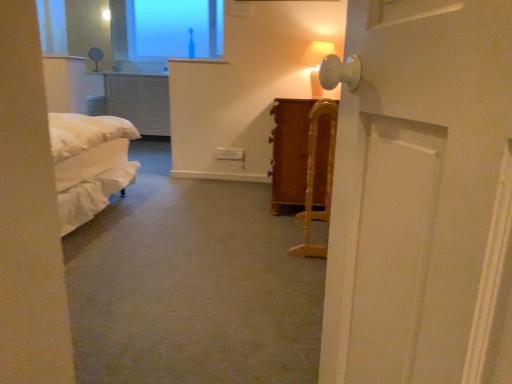
Question: From the image's perspective, relative to matte white table lamp at upper center, placed as the second table lamp when sorted from bottom to top, is wooden cane at center above or below?

Choices:
 (A) above
 (B) below

Answer: (B)

Question: Is wooden cane at center in front of or behind matte white table lamp at upper center, marked as the first table lamp in a left-to-right arrangement, in the image?

Choices:
 (A) behind
 (B) front

Answer: (B)

Question: Which object is the farthest from the wooden cane at center?

Choices:
 (A) matte white table lamp at upper right, which is the second table lamp in back-to-front order
 (B) matte white table lamp at upper center, marked as the first table lamp in a left-to-right arrangement
 (C) transparent glass window at upper center

Answer: (C)

Question: Which object is the farthest from the matte white table lamp at upper right, placed as the second table lamp when sorted from left to right?

Choices:
 (A) matte white table lamp at upper center, marked as the first table lamp in a left-to-right arrangement
 (B) transparent glass window at upper center
 (C) wooden cane at center

Answer: (B)